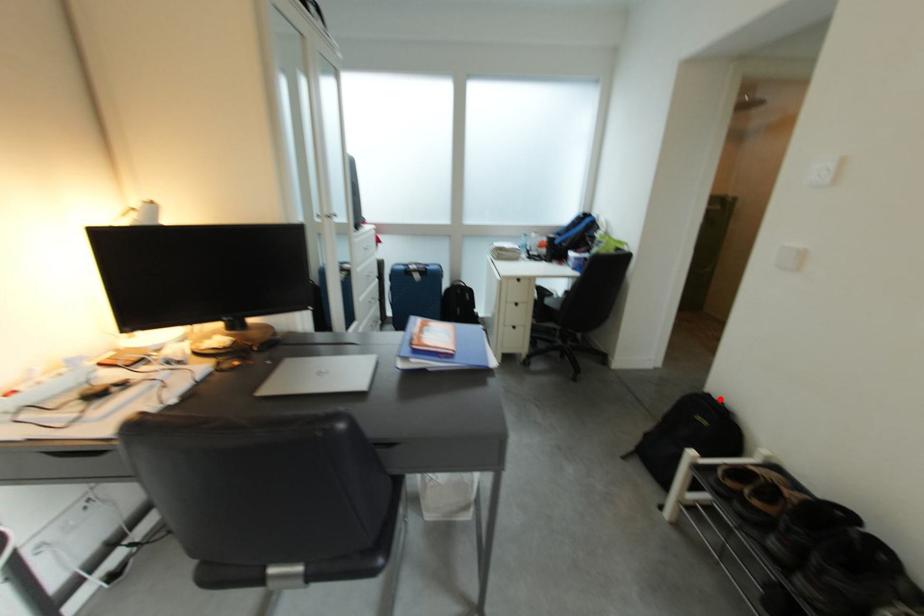
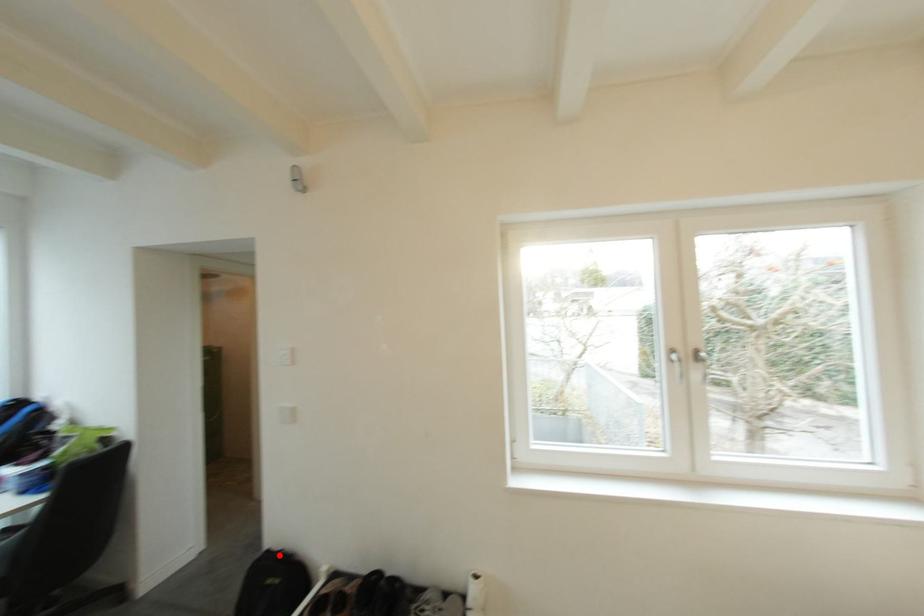
I am providing you with two images of the same scene from different viewpoints. A red point is marked on the first image and another point is marked on the second image. Are the points marked in image1 and image2 representing the same 3D position?

Yes